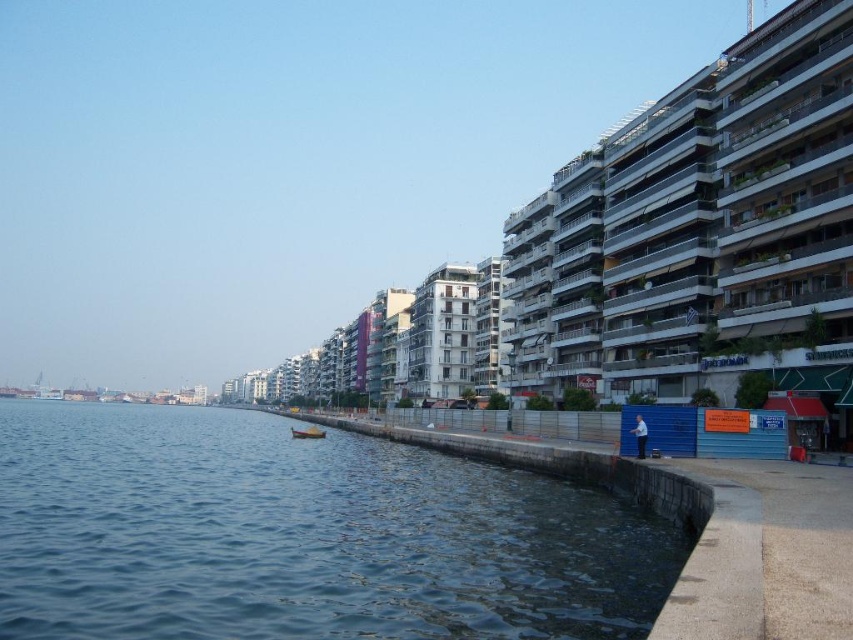
You are standing on the walkway and want to look at the blue water at lower left and the wooden boat at lower left. Which one is closer to the water surface?

The wooden boat at lower left is closer to the water surface because the blue water at lower left is below it.

You are standing on the walkway near the blue water at lower left and want to reach the nearest building on the right. The walkway is 2 meters wide. Can you walk straight ahead towards the building without stepping into the water?

The distance between the blue water at lower left and the viewer is 33.46 meters. Since the walkway is 2 meters wide, you can safely walk straight ahead towards the building on the right without stepping into the water as there is enough space between the walkway and the water.

You are standing on the walkway and want to take a photo of the wooden boat at lower left and the blue water at lower left. Which object should you focus on first to ensure both are in the frame?

You should focus on the wooden boat at lower left first because it is farther away from the viewer compared to the blue water at lower left, ensuring both are in the frame.